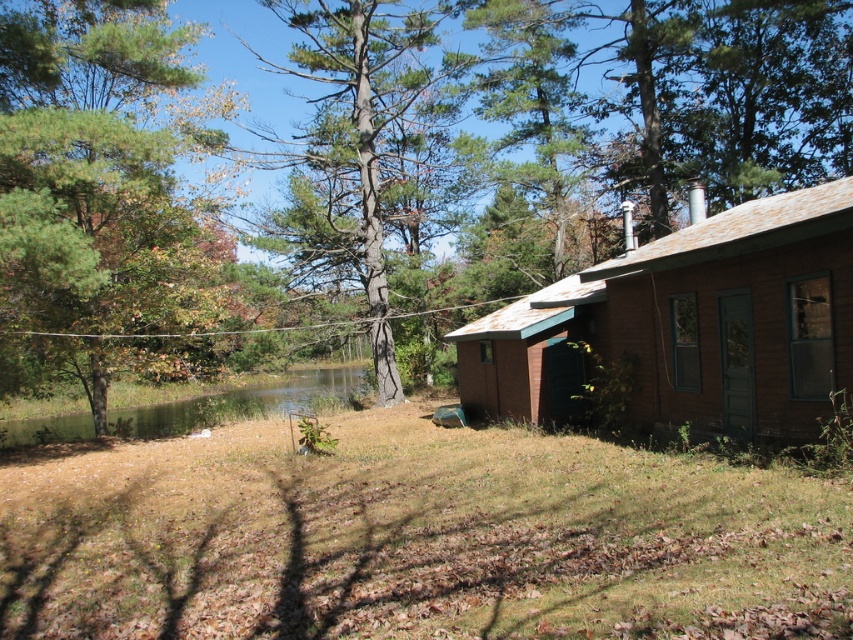
You are standing at the point labeled as point (102, 193) in the image. What object is located at this point?

The point (102, 193) indicates a green leafy tree at left.